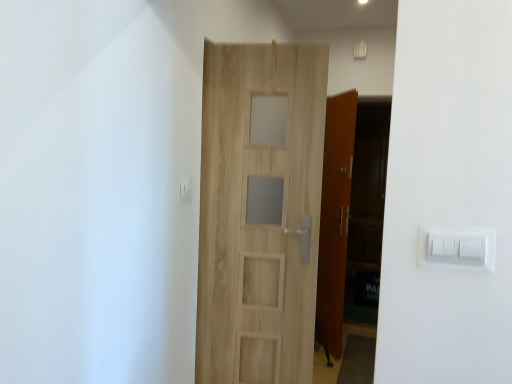
Question: Should I look upward or downward to see light wood door at center?

Choices:
 (A) up
 (B) down

Answer: (B)

Question: Which direction should I rotate to look at white plastic light switch at upper center, which is the second light switch in bottom-to-top order?

Choices:
 (A) left
 (B) right

Answer: (A)

Question: Is white plastic light switch at upper center, positioned as the first light switch in back-to-front order, directly adjacent to light wood door at center?

Choices:
 (A) no
 (B) yes

Answer: (A)

Question: Is white plastic light switch at upper center, the second light switch when ordered from front to back, far from light wood door at center?

Choices:
 (A) no
 (B) yes

Answer: (A)

Question: From the image's perspective, is white plastic light switch at upper center, arranged as the 1th light switch when viewed from the top, located above light wood door at center?

Choices:
 (A) yes
 (B) no

Answer: (A)

Question: Considering the relative sizes of white plastic light switch at upper center, arranged as the 1th light switch when viewed from the top, and light wood door at center in the image provided, is white plastic light switch at upper center, arranged as the 1th light switch when viewed from the top, bigger than light wood door at center?

Choices:
 (A) yes
 (B) no

Answer: (B)

Question: Considering the relative positions of white plastic light switch at upper center, the second light switch when ordered from front to back, and light wood door at center in the image provided, is white plastic light switch at upper center, the second light switch when ordered from front to back, to the right of light wood door at center from the viewer's perspective?

Choices:
 (A) yes
 (B) no

Answer: (B)

Question: Considering the relative sizes of white plastic light switch at upper center, positioned as the first light switch in back-to-front order, and light wood door at center in the image provided, is white plastic light switch at upper center, positioned as the first light switch in back-to-front order, taller than light wood door at center?

Choices:
 (A) no
 (B) yes

Answer: (A)

Question: Is white plastic light switch at right, marked as the first light switch in a right-to-left arrangement, directly adjacent to white plastic light switch at upper center, positioned as the first light switch in back-to-front order?

Choices:
 (A) no
 (B) yes

Answer: (A)

Question: Considering the relative positions of white plastic light switch at right, acting as the first light switch starting from the bottom, and white plastic light switch at upper center, the second light switch when ordered from front to back, in the image provided, is white plastic light switch at right, acting as the first light switch starting from the bottom, in front of white plastic light switch at upper center, the second light switch when ordered from front to back,?

Choices:
 (A) yes
 (B) no

Answer: (A)

Question: Considering the relative positions of white plastic light switch at right, the 2th light switch positioned from the back, and white plastic light switch at upper center, positioned as the first light switch in back-to-front order, in the image provided, is white plastic light switch at right, the 2th light switch positioned from the back, to the right of white plastic light switch at upper center, positioned as the first light switch in back-to-front order, from the viewer's perspective?

Choices:
 (A) yes
 (B) no

Answer: (A)

Question: Is white plastic light switch at right, acting as the first light switch starting from the bottom, facing away from white plastic light switch at upper center, the second light switch when ordered from front to back?

Choices:
 (A) no
 (B) yes

Answer: (A)

Question: Would you say white plastic light switch at upper center, arranged as the 1th light switch when viewed from the top, is part of white plastic light switch at right, marked as the first light switch in a right-to-left arrangement,'s contents?

Choices:
 (A) no
 (B) yes

Answer: (A)

Question: From the image's perspective, is white plastic light switch at right, marked as the first light switch in a right-to-left arrangement, beneath white plastic light switch at upper center, acting as the first light switch starting from the left?

Choices:
 (A) yes
 (B) no

Answer: (A)

Question: Can you confirm if white plastic light switch at right, arranged as the 2th light switch when viewed from the left, is positioned to the right of light wood door at center?

Choices:
 (A) no
 (B) yes

Answer: (B)